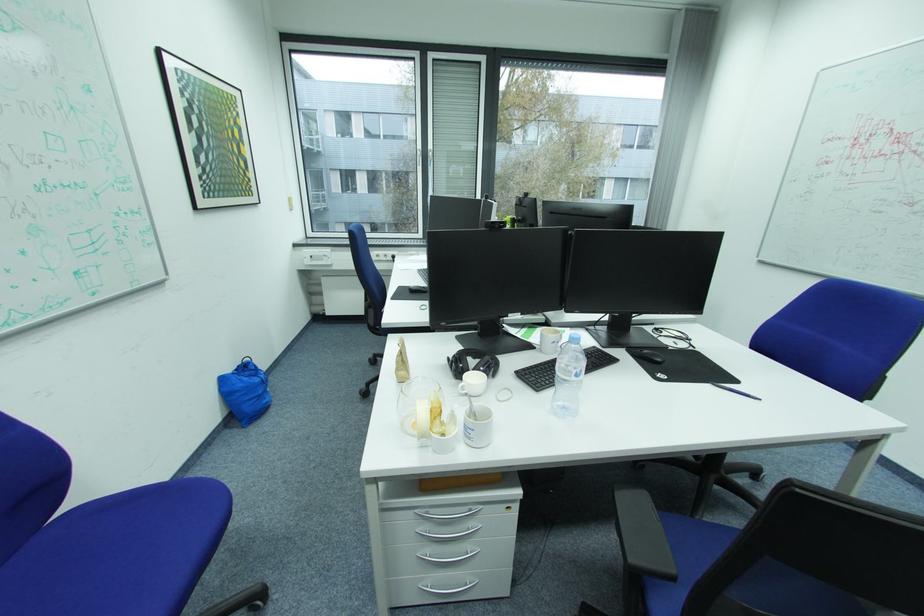
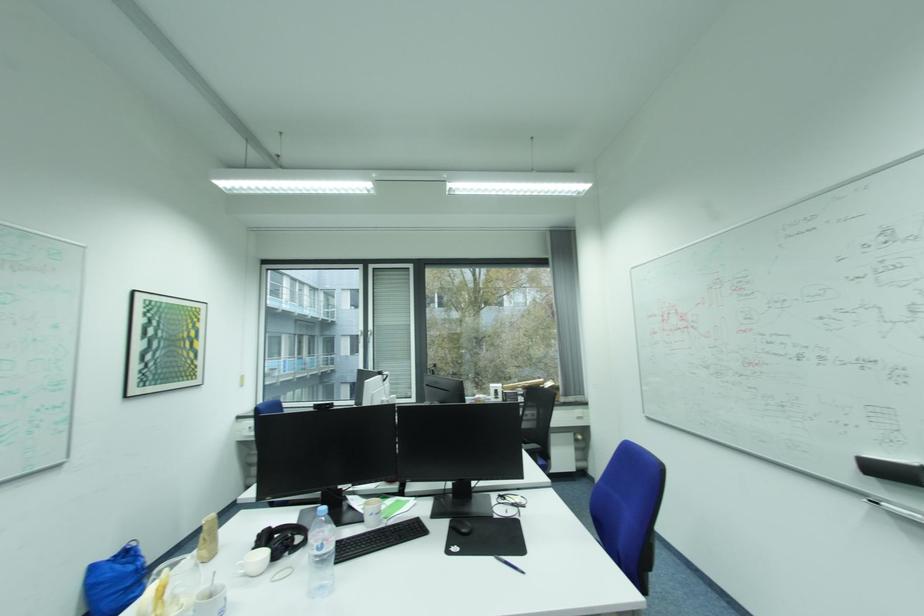
The point at (636, 351) is marked in the first image. Where is the corresponding point in the second image?

(458, 522)